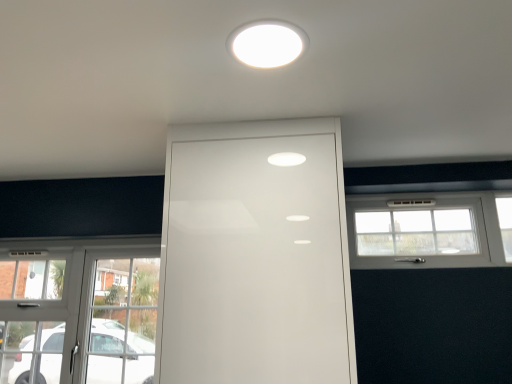
This screenshot has width=512, height=384. What do you see at coordinates (78, 311) in the screenshot? I see `clear glass door at lower left, which appears as the 2th window when viewed from the right` at bounding box center [78, 311].

The height and width of the screenshot is (384, 512). I want to click on white glossy door at center, so click(x=255, y=256).

Is point (429, 262) behind point (308, 188)?

Yes, point (429, 262) is behind point (308, 188).

Can you tell me how much white plastic window at right, the first window from the right, and white glossy door at center differ in facing direction?

The facing directions of white plastic window at right, the first window from the right, and white glossy door at center are 0.924 degrees apart.

Between white plastic window at right, marked as the 2th window in a bottom-to-top arrangement, and white glossy door at center, which one has more height?

white glossy door at center.

From the image's perspective, who appears lower, white plastic window at right, marked as the 2th window in a bottom-to-top arrangement, or white glossy door at center?

white glossy door at center is shown below in the image.

Is clear glass door at lower left, which is the second window from top to bottom, inside or outside of white plastic window at right, the first window from the right?

clear glass door at lower left, which is the second window from top to bottom, is not enclosed by white plastic window at right, the first window from the right.

Find the location of a particular element. window below the white plastic window at right, the first window from the right (from a real-world perspective) is located at coordinates (78, 311).

Which object is further away from the camera, clear glass door at lower left, which appears as the 2th window when viewed from the right, or white plastic window at right, which is counted as the 2th window, starting from the left?

clear glass door at lower left, which appears as the 2th window when viewed from the right, is more distant.

From a real-world perspective, who is located lower, clear glass door at lower left, the 1th window positioned from the bottom, or white plastic window at right, the first window from the right?

clear glass door at lower left, the 1th window positioned from the bottom, is physically lower.

Can you tell me how much white plastic window at right, the first window from the right, and white glossy light fixture at upper center differ in facing direction?

They differ by 89.1 degrees in their facing directions.

From the image's perspective, is white plastic window at right, the first window from the right, on top of white glossy light fixture at upper center?

Actually, white plastic window at right, the first window from the right, appears below white glossy light fixture at upper center in the image.

Which object is more forward, white plastic window at right, marked as the 2th window in a bottom-to-top arrangement, or white glossy light fixture at upper center?

white glossy light fixture at upper center is in front.

Measure the distance from white plastic window at right, arranged as the 1th window when viewed from the top, to white glossy light fixture at upper center.

The distance of white plastic window at right, arranged as the 1th window when viewed from the top, from white glossy light fixture at upper center is 1.38 meters.

Is clear glass door at lower left, which appears as the 2th window when viewed from the right, smaller than white glossy door at center?

Yes, clear glass door at lower left, which appears as the 2th window when viewed from the right, is smaller than white glossy door at center.

Is clear glass door at lower left, the 1th window positioned from the bottom, not near white glossy door at center?

Indeed, clear glass door at lower left, the 1th window positioned from the bottom, is not near white glossy door at center.

Is clear glass door at lower left, which is the second window from top to bottom, taller or shorter than white glossy door at center?

Considering their sizes, clear glass door at lower left, which is the second window from top to bottom, has less height than white glossy door at center.

Relative to white glossy door at center, is clear glass door at lower left, which appears as the 2th window when viewed from the right, in front or behind?

Visually, clear glass door at lower left, which appears as the 2th window when viewed from the right, is located behind white glossy door at center.

Consider the image. Between white glossy light fixture at upper center and white glossy door at center, which one has larger size?

Bigger between the two is white glossy door at center.

From the image's perspective, which one is positioned lower, white glossy light fixture at upper center or white glossy door at center?

white glossy door at center.

Is there a large distance between white glossy light fixture at upper center and white glossy door at center?

white glossy light fixture at upper center is near white glossy door at center, not far away.

In the scene shown: Measure the distance from white glossy light fixture at upper center to white glossy door at center.

white glossy light fixture at upper center and white glossy door at center are 60.40 centimeters apart from each other.

Consider the image. Which object is positioned more to the right, clear glass door at lower left, the 1th window positioned from the bottom, or white glossy light fixture at upper center?

From the viewer's perspective, white glossy light fixture at upper center appears more on the right side.

Which of these two, clear glass door at lower left, which is the second window from top to bottom, or white glossy light fixture at upper center, is bigger?

clear glass door at lower left, which is the second window from top to bottom.

Who is more distant, clear glass door at lower left, which is the second window from top to bottom, or white glossy light fixture at upper center?

clear glass door at lower left, which is the second window from top to bottom, is further from the camera.

Is clear glass door at lower left, which appears as the first window when viewed from the left, beside white glossy light fixture at upper center?

No, clear glass door at lower left, which appears as the first window when viewed from the left, is not touching white glossy light fixture at upper center.

Considering the sizes of objects white plastic window at right, marked as the 2th window in a bottom-to-top arrangement, and clear glass door at lower left, which appears as the 2th window when viewed from the right, in the image provided, who is thinner, white plastic window at right, marked as the 2th window in a bottom-to-top arrangement, or clear glass door at lower left, which appears as the 2th window when viewed from the right,?

Thinner between the two is white plastic window at right, marked as the 2th window in a bottom-to-top arrangement.

There is a clear glass door at lower left, the 1th window positioned from the bottom. Where is `window above it (from a real-world perspective)`? The image size is (512, 384). window above it (from a real-world perspective) is located at coordinates (426, 230).

Can you confirm if white plastic window at right, the first window from the right, is smaller than clear glass door at lower left, which appears as the first window when viewed from the left?

Indeed, white plastic window at right, the first window from the right, has a smaller size compared to clear glass door at lower left, which appears as the first window when viewed from the left.

Could you tell me if white plastic window at right, which is counted as the 2th window, starting from the left, is facing clear glass door at lower left, which is the second window from top to bottom?

No, white plastic window at right, which is counted as the 2th window, starting from the left, is not oriented towards clear glass door at lower left, which is the second window from top to bottom.

The width and height of the screenshot is (512, 384). I want to click on window located above the white glossy door at center (from a real-world perspective), so point(426,230).

The height and width of the screenshot is (384, 512). I want to click on window below the white plastic window at right, which is counted as the 2th window, starting from the left (from a real-world perspective), so click(x=78, y=311).

Estimate the real-world distances between objects in this image. Which object is closer to white glossy light fixture at upper center, clear glass door at lower left, which appears as the 2th window when viewed from the right, or white plastic window at right, arranged as the 1th window when viewed from the top?

The object closer to white glossy light fixture at upper center is white plastic window at right, arranged as the 1th window when viewed from the top.

When comparing their distances from white glossy light fixture at upper center, does white plastic window at right, the first window from the right, or white glossy door at center seem closer?

white glossy door at center is positioned closer to the anchor white glossy light fixture at upper center.

Based on their spatial positions, is white plastic window at right, the first window from the right, or white glossy door at center closer to clear glass door at lower left, which appears as the 2th window when viewed from the right?

white glossy door at center.

When comparing their distances from white glossy door at center, does clear glass door at lower left, which appears as the 2th window when viewed from the right, or white glossy light fixture at upper center seem closer?

white glossy light fixture at upper center.

Estimate the real-world distances between objects in this image. Which object is closer to white glossy door at center, clear glass door at lower left, which is the second window from top to bottom, or white plastic window at right, which is counted as the 2th window, starting from the left?

white plastic window at right, which is counted as the 2th window, starting from the left, is positioned closer to the anchor white glossy door at center.

Which object lies nearer to the anchor point white glossy light fixture at upper center, white glossy door at center or clear glass door at lower left, which appears as the 2th window when viewed from the right?

Among the two, white glossy door at center is located nearer to white glossy light fixture at upper center.

From the image, which object appears to be nearer to white glossy light fixture at upper center, clear glass door at lower left, which appears as the 2th window when viewed from the right, or white glossy door at center?

Based on the image, white glossy door at center appears to be nearer to white glossy light fixture at upper center.

Based on their spatial positions, is white glossy light fixture at upper center or clear glass door at lower left, which is the second window from top to bottom, further from white glossy door at center?

Among the two, clear glass door at lower left, which is the second window from top to bottom, is located further to white glossy door at center.

Where is `lighting between clear glass door at lower left, the 1th window positioned from the bottom, and white plastic window at right, the first window from the right, from left to right`? lighting between clear glass door at lower left, the 1th window positioned from the bottom, and white plastic window at right, the first window from the right, from left to right is located at coordinates (267, 45).

Identify the location of door between clear glass door at lower left, which appears as the first window when viewed from the left, and white glossy light fixture at upper center, in the horizontal direction. This screenshot has width=512, height=384. (255, 256).

The height and width of the screenshot is (384, 512). I want to click on door between clear glass door at lower left, which is the second window from top to bottom, and white plastic window at right, the first window from the right, from left to right, so click(x=255, y=256).

Find the location of a particular element. This screenshot has width=512, height=384. door positioned between white glossy light fixture at upper center and white plastic window at right, marked as the 2th window in a bottom-to-top arrangement, from near to far is located at coordinates (255, 256).